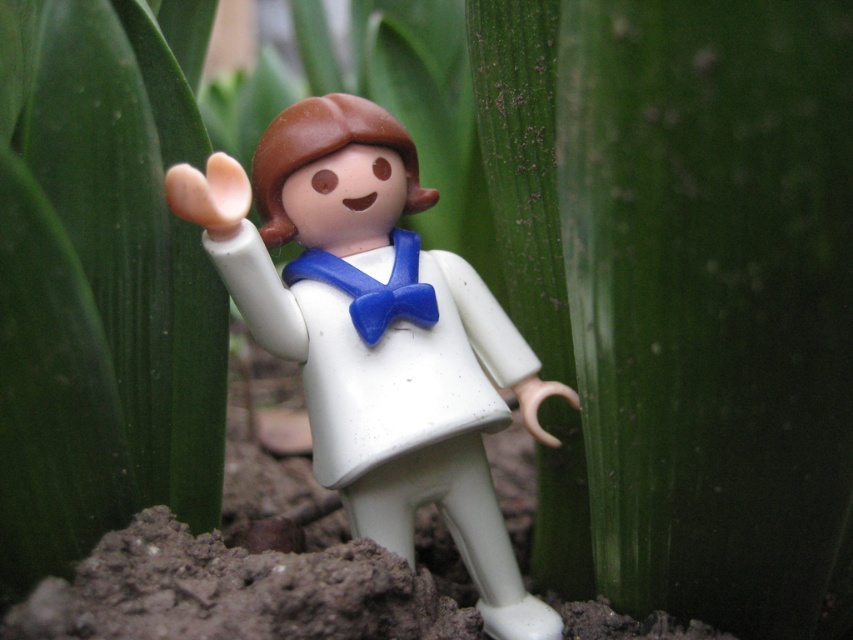
Which is behind, point (51, 312) or point (331, 256)?

Positioned behind is point (331, 256).

Does green matte leaf at center appear under blue plastic bow tie at center?

No.

Does point (190, 100) come in front of point (314, 259)?

Yes, point (190, 100) is closer to viewer.

You are a GUI agent. You are given a task and a screenshot of the screen. Output one action in this format:
    pyautogui.click(x=<x>, y=<y>)
    Task: Click on the green matte leaf at center
    This screenshot has height=640, width=853.
    Given the screenshot: What is the action you would take?
    pyautogui.click(x=102, y=280)

Is point (483, 536) in front of point (416, 288)?

No.

From the picture: Can you confirm if white plastic toy at center is positioned to the left of blue plastic bow tie at center?

No, white plastic toy at center is not to the left of blue plastic bow tie at center.

Is point (347, 321) behind point (309, 269)?

No, it is in front of (309, 269).

Locate an element on the screen. white plastic toy at center is located at coordinates (376, 333).

Who is taller, green matte leaf at center or white plastic toy at center?

green matte leaf at center is taller.

This screenshot has width=853, height=640. Describe the element at coordinates (102, 280) in the screenshot. I see `green matte leaf at center` at that location.

Is point (142, 458) farther from camera compared to point (474, 568)?

No.

This screenshot has width=853, height=640. What are the coordinates of `green matte leaf at center` in the screenshot? It's located at (102, 280).